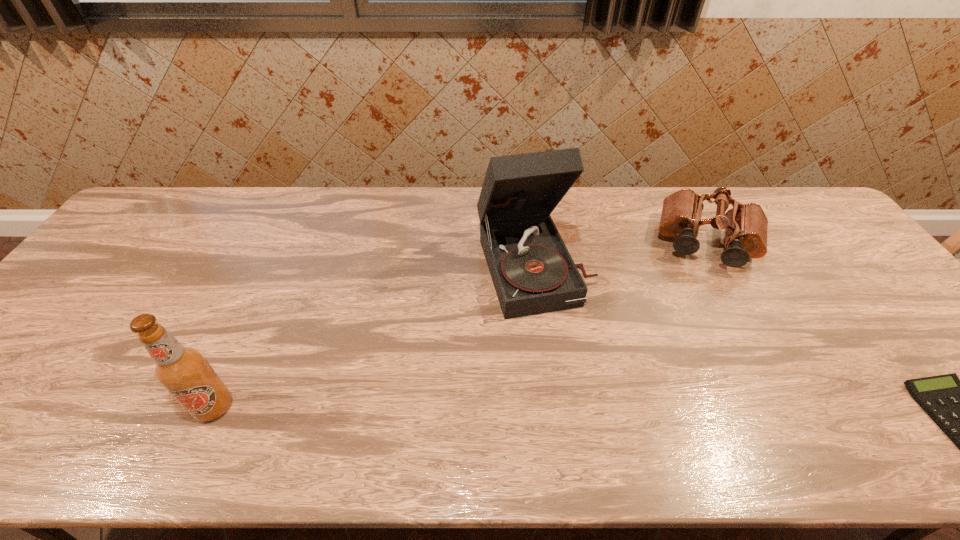
You are a GUI agent. You are given a task and a screenshot of the screen. Output one action in this format:
    pyautogui.click(x=<x>, y=<y>)
    Task: Click on the third shortest object
    This screenshot has height=540, width=960.
    Given the screenshot: What is the action you would take?
    pyautogui.click(x=183, y=371)

Identify the location of beer bottle. This screenshot has width=960, height=540. (183, 371).

Identify the location of the third object from right to left. This screenshot has height=540, width=960. [533, 273].

Locate an element on the screen. This screenshot has height=540, width=960. the tallest object is located at coordinates (533, 273).

Where is `the third tallest object`? This screenshot has width=960, height=540. the third tallest object is located at coordinates (745, 225).

Locate an element on the screen. Image resolution: width=960 pixels, height=540 pixels. binoculars is located at coordinates (745, 225).

Locate an element on the screen. vacant space located on the front-facing side of the phonograph_record is located at coordinates (561, 337).

What are the coordinates of `vacant space situated on the front-facing side of the phonograph_record` in the screenshot? It's located at tap(587, 401).

Image resolution: width=960 pixels, height=540 pixels. Identify the location of free space located 0.050m on the front-facing side of the phonograph_record. (559, 334).

At what (x,y) coordinates should I click in order to perform the action: click on free space located 0.250m through the eyepieces of the third tallest object. Please return your answer as a coordinate pair (x, y). Looking at the image, I should click on (694, 339).